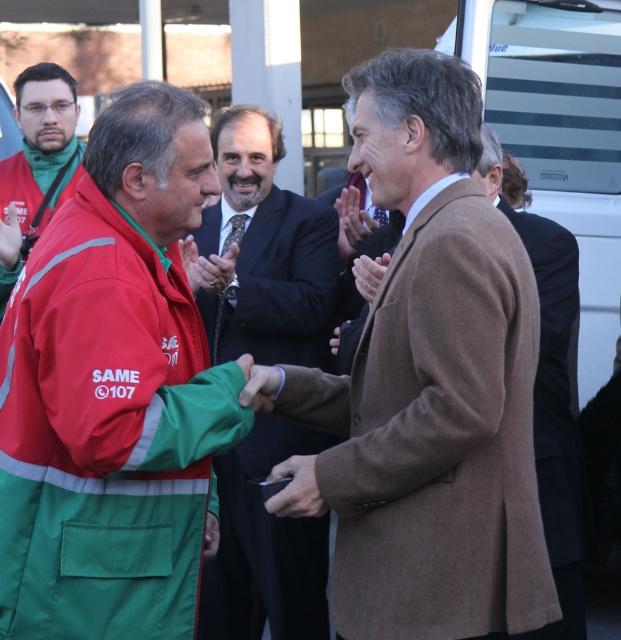
Question: Estimate the real-world distances between objects in this image. Which object is farther from the red reflective jacket at left?

Choices:
 (A) brown wool coat at center
 (B) brown woolen coat at center

Answer: (B)

Question: Is brown woolen coat at center bigger than green fabric jacket at center?

Choices:
 (A) yes
 (B) no

Answer: (A)

Question: Which point appears farthest from the camera in this image?

Choices:
 (A) (414, 532)
 (B) (52, 208)

Answer: (B)

Question: Which of these objects is positioned closest to the brown woolen coat at center?

Choices:
 (A) green fabric jacket at center
 (B) brown wool coat at center
 (C) red reflective jacket at left

Answer: (B)

Question: Can you confirm if brown woolen coat at center is smaller than red reflective jacket at left?

Choices:
 (A) no
 (B) yes

Answer: (A)

Question: In this image, where is green fabric jacket at center located relative to red reflective jacket at left?

Choices:
 (A) below
 (B) above

Answer: (A)